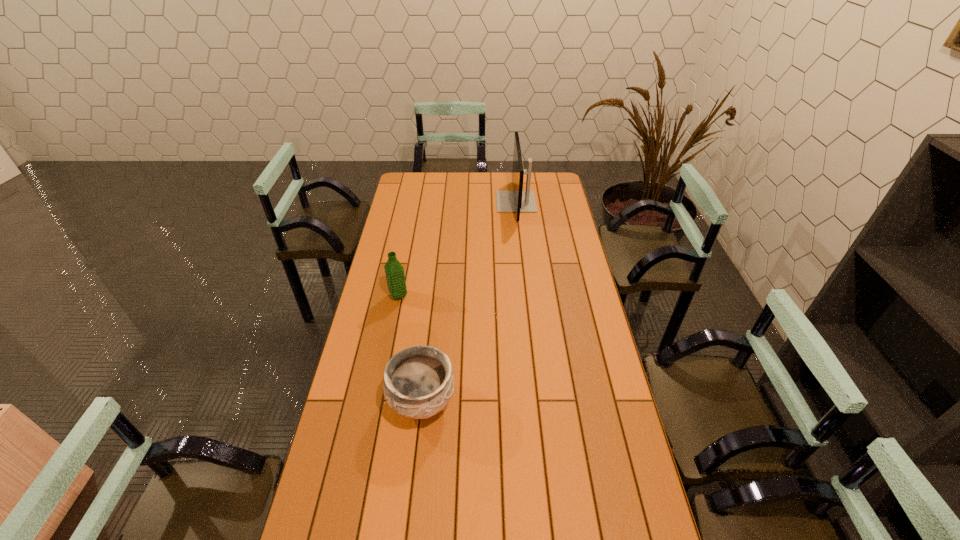
What are the coordinates of `vacant space that is in between the farthest object and the second shortest object` in the screenshot? It's located at (457, 249).

In order to click on empty space that is in between the computer monitor and the second tallest object in this screenshot , I will do `click(457, 249)`.

Image resolution: width=960 pixels, height=540 pixels. Find the location of `free spot between the farthest object and the pottery`. free spot between the farthest object and the pottery is located at coordinates (468, 302).

Locate an element on the screen. free point between the computer monitor and the nearest object is located at coordinates (468, 302).

This screenshot has width=960, height=540. What are the coordinates of `blank region between the second nearest object and the farthest object` in the screenshot? It's located at (457, 249).

Identify the location of free spot between the shortest object and the computer monitor. (468, 302).

You are a GUI agent. You are given a task and a screenshot of the screen. Output one action in this format:
    pyautogui.click(x=<x>, y=<y>)
    Task: Click on the object that can be found as the closest to the shortest object
    Image resolution: width=960 pixels, height=540 pixels.
    Given the screenshot: What is the action you would take?
    pyautogui.click(x=394, y=271)

At what (x,y) coordinates should I click in order to perform the action: click on object that is the second closest to the shortest object. Please return your answer as a coordinate pair (x, y). This screenshot has width=960, height=540. Looking at the image, I should click on [517, 200].

Where is `free location that satisfies the following two spatial constraints: 1. on the screen of the rightmost object; 2. on the front side of the pottery`? The height and width of the screenshot is (540, 960). free location that satisfies the following two spatial constraints: 1. on the screen of the rightmost object; 2. on the front side of the pottery is located at coordinates (539, 402).

Find the location of a particular element. This screenshot has height=540, width=960. free spot that satisfies the following two spatial constraints: 1. on the front side of the second farthest object; 2. on the right side of the pottery is located at coordinates (378, 402).